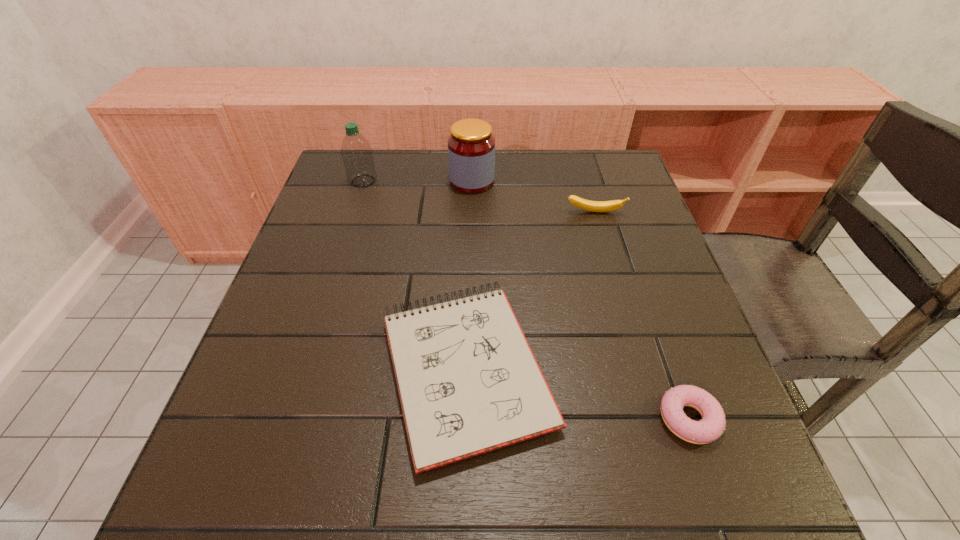
You are a GUI agent. You are given a task and a screenshot of the screen. Output one action in this format:
    pyautogui.click(x=<x>, y=<y>)
    Task: Click on the vacant space situated 0.180m on the back of the notepad
    This screenshot has width=960, height=540.
    Given the screenshot: What is the action you would take?
    pyautogui.click(x=469, y=234)

Identify the location of water bottle that is at the far edge. (356, 152).

Where is `jar that is at the far edge`? This screenshot has width=960, height=540. jar that is at the far edge is located at coordinates (471, 146).

At what (x,y) coordinates should I click in order to perform the action: click on object that is at the near edge. Please return your answer as a coordinate pair (x, y). The width and height of the screenshot is (960, 540). Looking at the image, I should click on (468, 382).

This screenshot has height=540, width=960. I want to click on object that is at the left edge, so click(356, 152).

The image size is (960, 540). What are the coordinates of `banana that is at the right edge` in the screenshot? It's located at (594, 206).

I want to click on doughnut present at the right edge, so click(712, 425).

Identify the location of object that is positioned at the far left corner. (356, 152).

Locate an element on the screen. free point at the far edge is located at coordinates (511, 168).

Locate an element on the screen. The height and width of the screenshot is (540, 960). vacant space at the left edge of the desktop is located at coordinates pos(274,314).